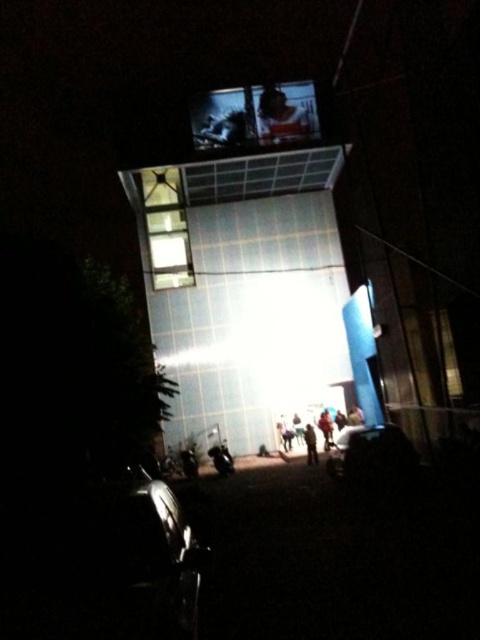
You are standing at the entrance of the building and want to take a photo of the blurred fabric person at center. Where should you position yourself to capture them in the frame?

The blurred fabric person at center is located at coordinates point (311, 444), so you should position yourself directly in front of the entrance to capture them in the frame.

In the scene shown: You are a photographer standing at a distance from the building. You want to take a photo of the blurred fabric person at center and the light brown fabric pants at center so that both are clearly visible in the frame. Given their distance apart, is it possible to capture both in a single shot without zooming in?

The blurred fabric person at center and light brown fabric pants at center are 5.83 feet apart. Since they are relatively close to each other, it is possible to capture both in a single shot without zooming in, provided the camera has an appropriate focal length and framing.